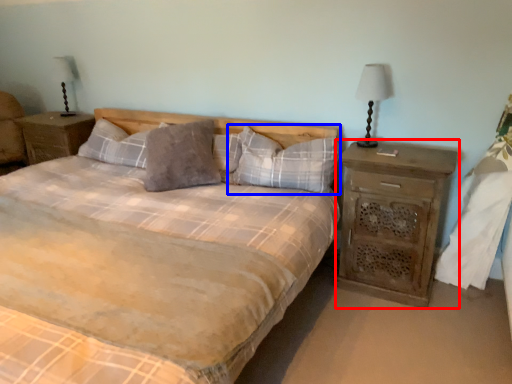
Question: Which point is closer to the camera, nightstand (highlighted by a red box) or pillow (highlighted by a blue box)?

Choices:
 (A) nightstand
 (B) pillow

Answer: (A)